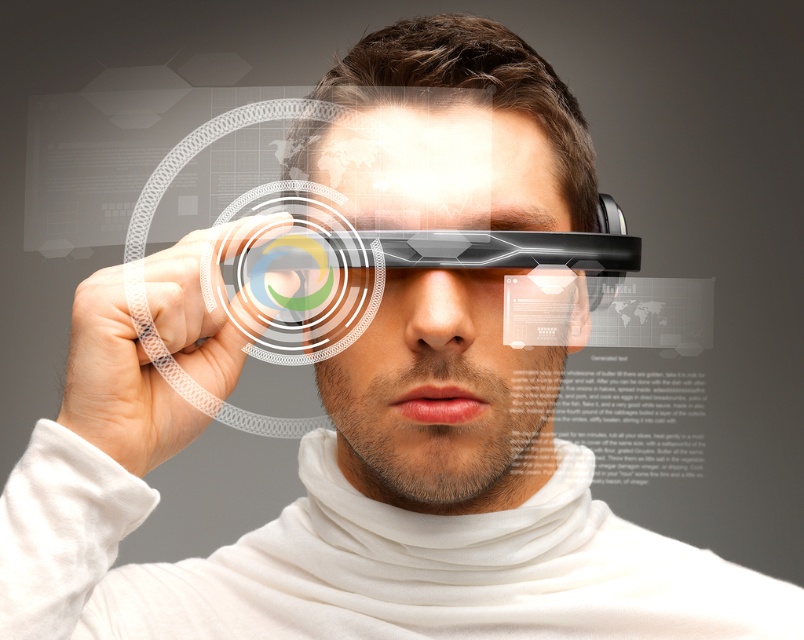
You are a photographer trying to capture a closeup of the digital interface on the futuristic glasses. You notice two points marked as point (536,436) and point (142,365) on the screen. Which point should you focus on to ensure the closest possible focus on the interface?

Point (536,436) is further to the camera than point (142,365). Therefore, focusing on point (536,436) will allow the photographer to capture a closer focus on the interface since it is nearer to the camera compared to the other point.

You are designing a new augmented reality interface and need to ensure that the transparent plastic face at center and the translucent plastic hand at center are visible to the user. Given their sizes, which object will appear larger in the user interface?

The transparent plastic face at center appears larger in the user interface because it has a greater height compared to the translucent plastic hand at center.

In the scene shown: You are a designer trying to create a 3D model of the futuristic glasses shown in the image. You need to determine the spatial relationship between the transparent plastic face at center and the translucent plastic hand at center. Which object is positioned higher in the image?

The transparent plastic face at center is positioned higher than the translucent plastic hand at center in the image.